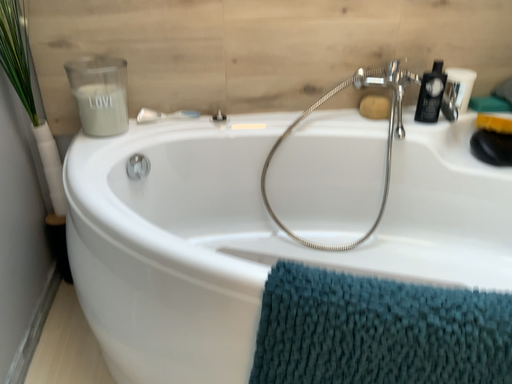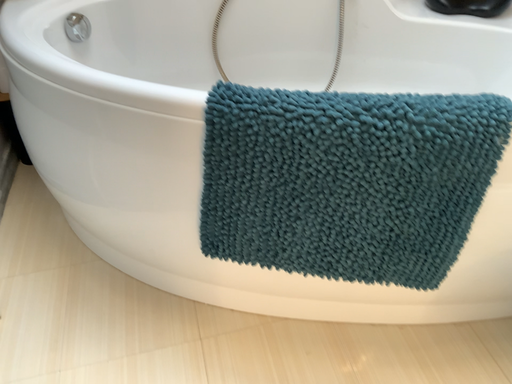
Question: How did the camera likely rotate when shooting the video?

Choices:
 (A) rotated upward
 (B) rotated downward

Answer: (B)